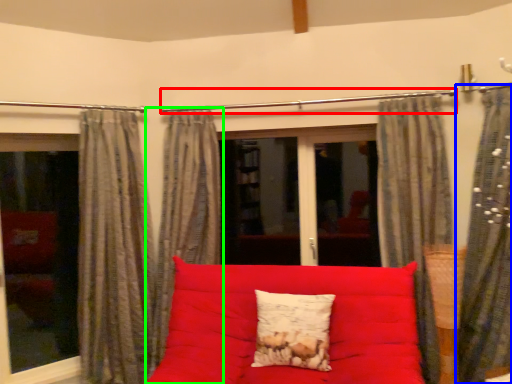
Question: Which is farther away from clothesline (highlighted by a red box)? curtain (highlighted by a blue box) or curtain (highlighted by a green box)?

Choices:
 (A) curtain
 (B) curtain

Answer: (A)